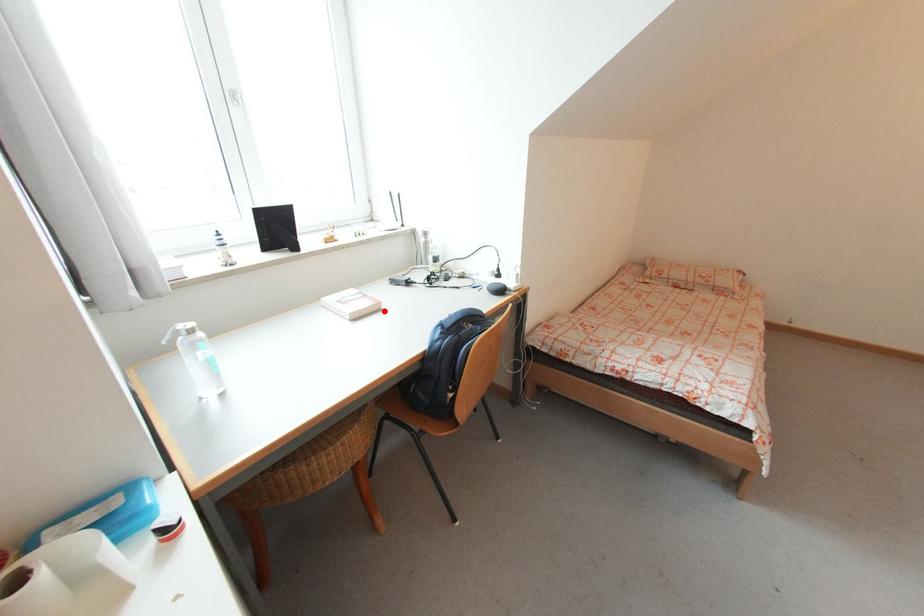
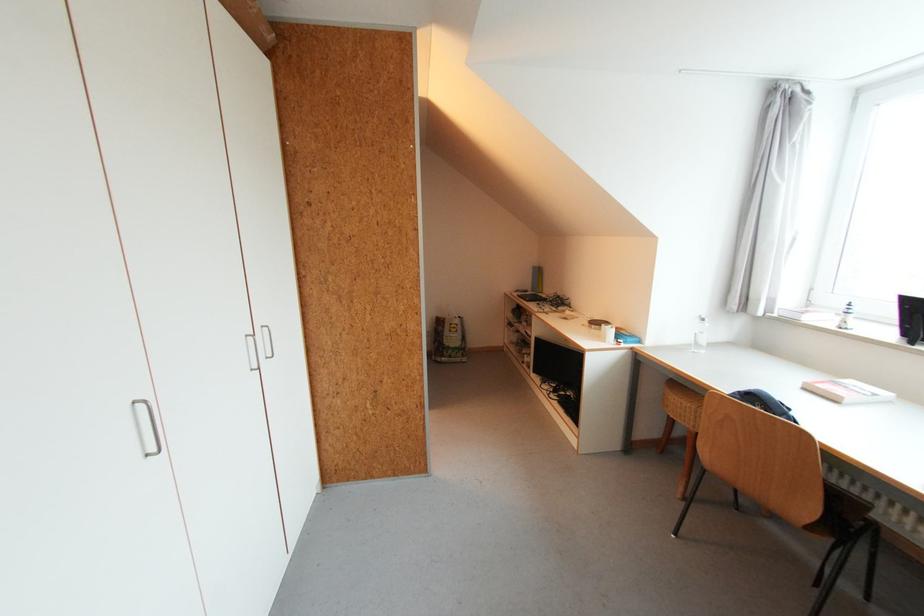
Locate, in the second image, the point that corresponds to the highlighted location in the first image.

(841, 403)